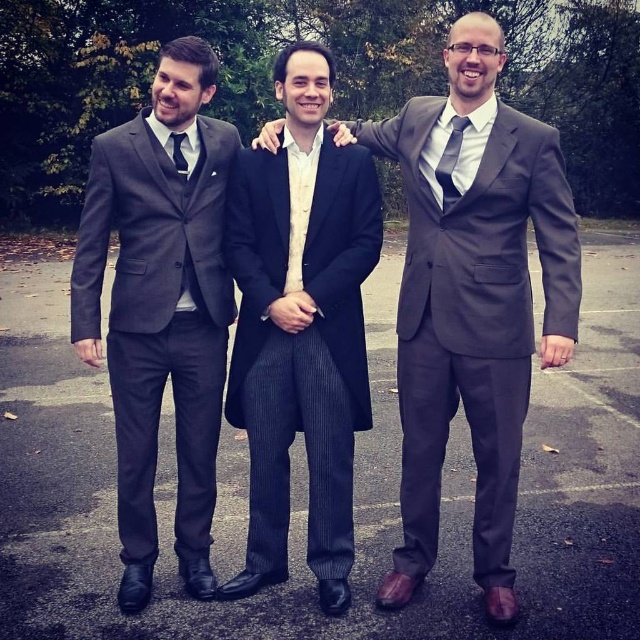
Question: Does matte black suit at left appear over dark gray silk tie at center?

Choices:
 (A) yes
 (B) no

Answer: (B)

Question: Can you confirm if matte black suit at left is bigger than matte black tie at center?

Choices:
 (A) no
 (B) yes

Answer: (B)

Question: Can you confirm if black pinstripe suit at center is positioned to the right of matte black tie at center?

Choices:
 (A) yes
 (B) no

Answer: (A)

Question: Which of these objects is positioned farthest from the dark gray suit at center?

Choices:
 (A) dark gray silk tie at center
 (B) matte black tie at center
 (C) black pinstripe suit at center
 (D) matte black suit at left

Answer: (B)

Question: Which of the following is the farthest from the observer?

Choices:
 (A) (173, 136)
 (B) (448, 371)
 (C) (209, 77)
 (D) (276, 524)

Answer: (D)

Question: Among these objects, which one is nearest to the camera?

Choices:
 (A) dark gray suit at center
 (B) black pinstripe suit at center

Answer: (A)